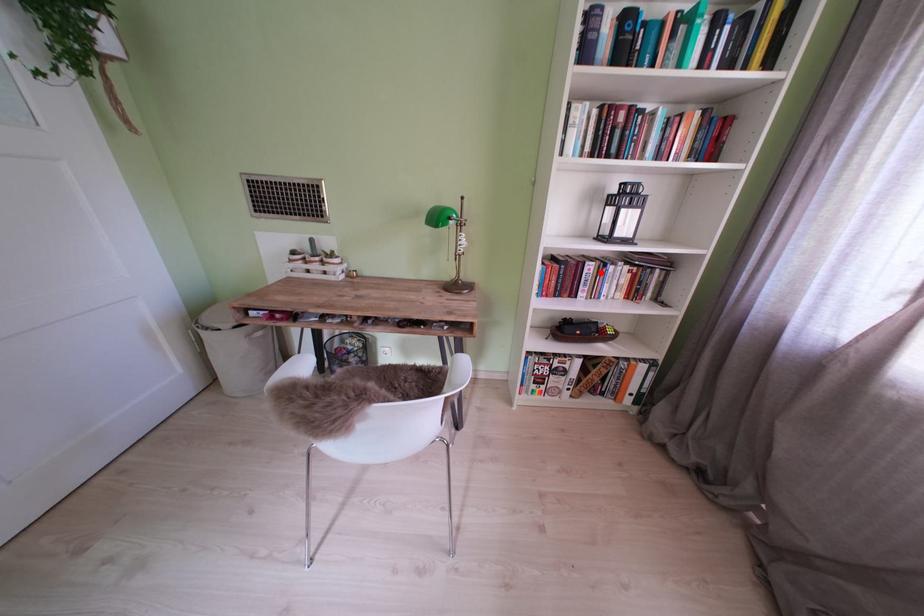
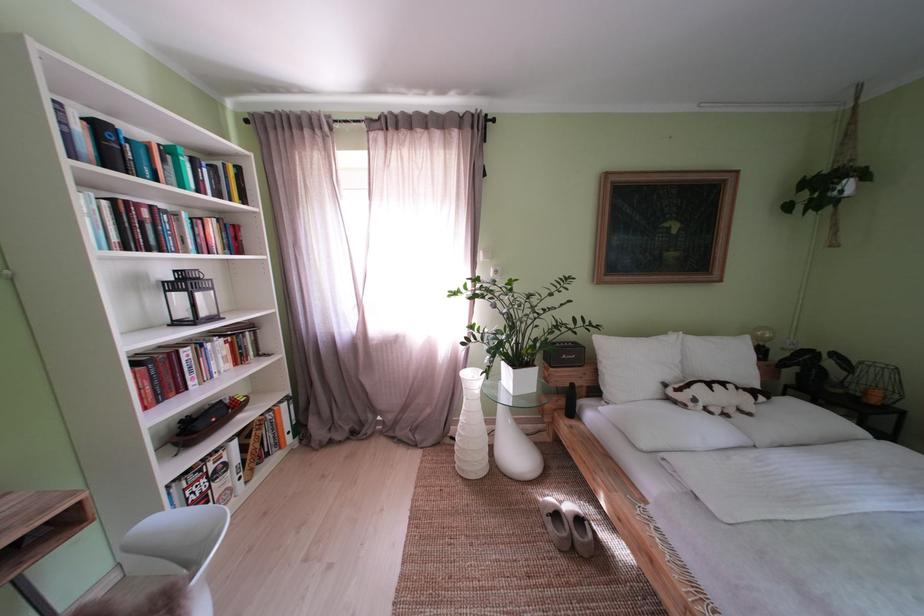
Where in the second image is the point corresponding to the highlighted location from the first image?

(199, 359)